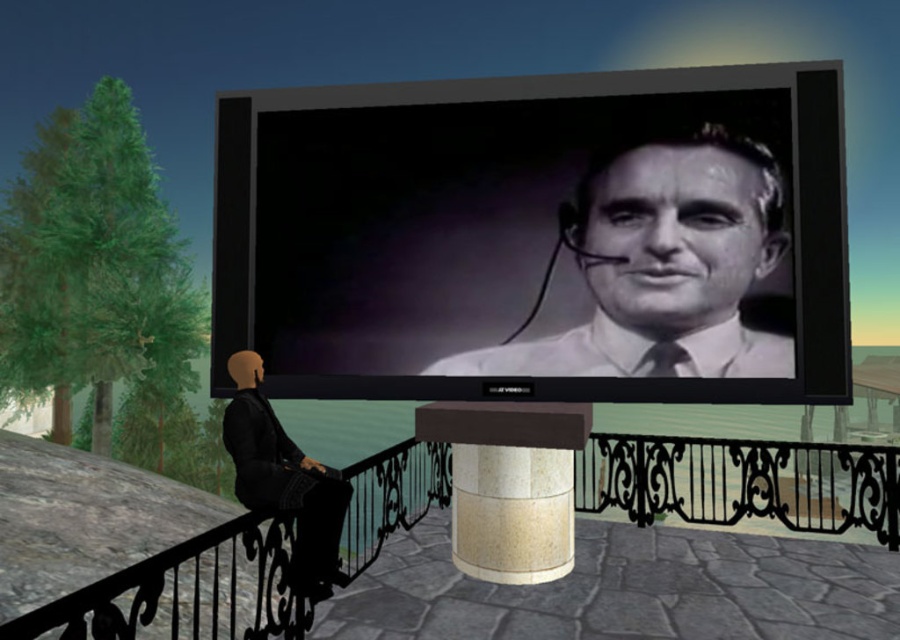
You are a painter standing on the balcony. You want to paint the beige marble pillar at center but need to step over the black wrought iron balustrade at lower center. Can you step over it easily?

The black wrought iron balustrade at lower center is larger in size than beige marble pillar at center, so it might be difficult to step over it easily.

You are a painter who wants to capture the scene accurately. You notice the black glossy screen at center and the black wrought iron balustrade at lower center. Which object should you paint first if you follow the rule of painting smaller objects before larger ones?

The black glossy screen at center is smaller than the black wrought iron balustrade at lower center, so you should paint the black glossy screen at center first.